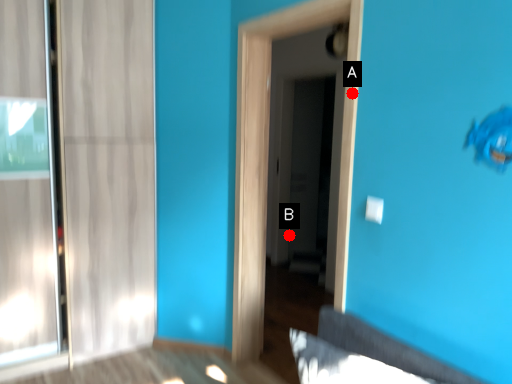
Question: Two points are circled on the image, labeled by A and B beside each circle. Which point appears farthest from the camera in this image?

Choices:
 (A) A is further
 (B) B is further

Answer: (B)